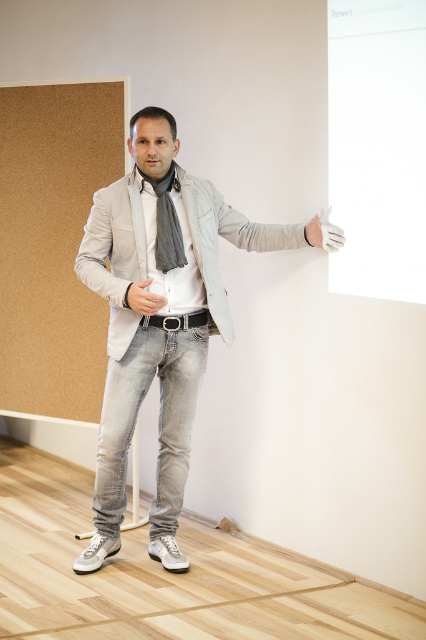
You are a photographer adjusting the lighting for a photo shoot. You notice the gray fabric scarf at center and the white matte glove at upper right. Which object should you focus on first to ensure proper lighting, considering their positions?

You should focus on the gray fabric scarf at center first because it is in front of the white matte glove at upper right, so adjusting its lighting will also affect the visibility of the glove behind it.

You are attending a virtual meeting and see the presenter wearing both a gray fabric scarf at center and a matte gray glove at center. Which item is positioned higher on his body?

The gray fabric scarf at center is taller than the matte gray glove at center, so the scarf is positioned higher on his body.

You are an event organizer setting up a presentation room. You need to hang a promotional banner between the corkboard at left and the white glossy board at upper right. Which object should you place the banner above to ensure it is higher?

The white glossy board at upper right is positioned higher up, so placing the banner above it would ensure the banner is at a higher elevation.